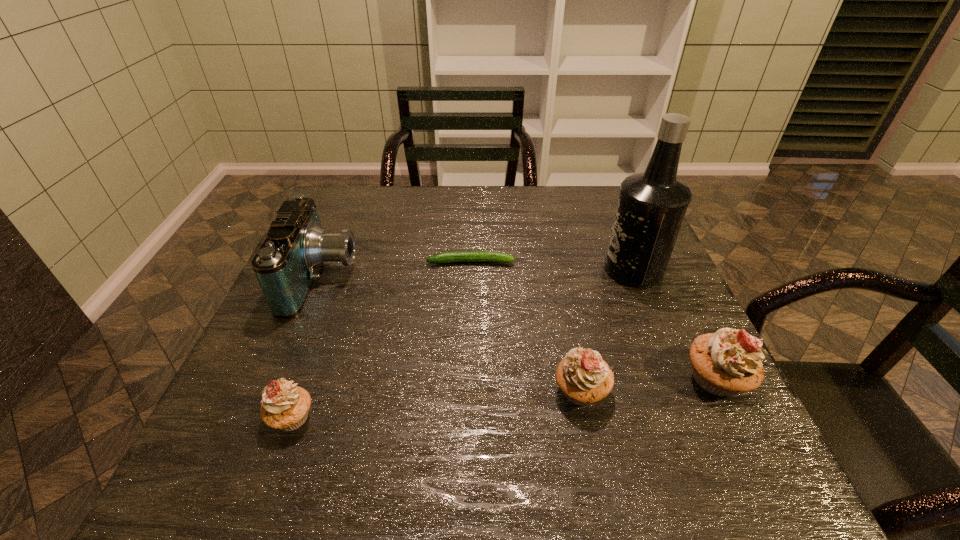
Where is `vacant space located 0.310m on the left of the third shortest object`? The image size is (960, 540). vacant space located 0.310m on the left of the third shortest object is located at coordinates coord(392,391).

This screenshot has width=960, height=540. In order to click on blank area located on the back of the rightmost cupcake in this screenshot , I will do `click(653, 250)`.

Find the location of a particular element. The width and height of the screenshot is (960, 540). vacant space situated on the front-facing side of the camcorder is located at coordinates (404, 278).

At what (x,y) coordinates should I click in order to perform the action: click on vacant space positioned 0.340m on the front-facing side of the shortest object. Please return your answer as a coordinate pair (x, y). The image size is (960, 540). Looking at the image, I should click on (646, 262).

Where is `vacant point located 0.270m on the front label of the tallest object`? The image size is (960, 540). vacant point located 0.270m on the front label of the tallest object is located at coordinates (497, 269).

You are a GUI agent. You are given a task and a screenshot of the screen. Output one action in this format:
    pyautogui.click(x=<x>, y=<y>)
    Task: Click on the vacant space located on the front label of the tallest object
    The width and height of the screenshot is (960, 540).
    Given the screenshot: What is the action you would take?
    pyautogui.click(x=533, y=269)

Locate an element on the screen. The width and height of the screenshot is (960, 540). free spot located on the front label of the tallest object is located at coordinates (477, 269).

Where is `cupcake that is at the left edge`? cupcake that is at the left edge is located at coordinates (285, 406).

This screenshot has width=960, height=540. Find the location of `camcorder situated at the left edge`. camcorder situated at the left edge is located at coordinates (286, 265).

Locate an element on the screen. cupcake situated at the right edge is located at coordinates (725, 363).